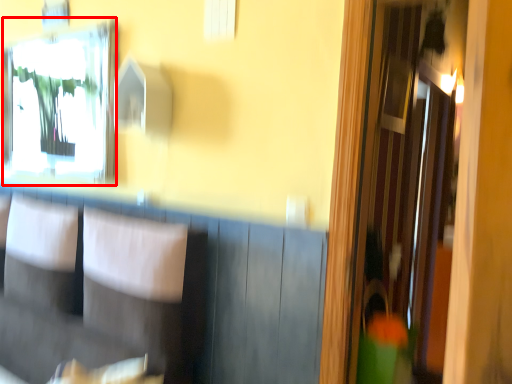
Question: From the image's perspective, where is mirror (annotated by the red box) located relative to armchair?

Choices:
 (A) above
 (B) below

Answer: (A)